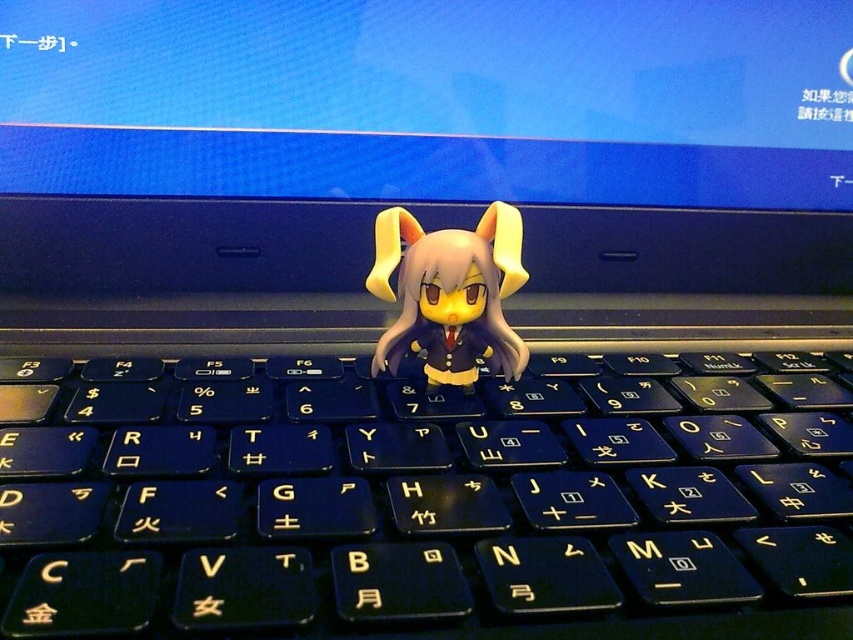
Based on the photo, you are setting up a desk for a friend who is left handed. You have a black plastic keyboard at center and a matte yellow plastic toy at center. Which object should you move to the right side of the desk to make space for their left hand?

The black plastic keyboard at center is in front of the matte yellow plastic toy at center. To make space for the left hand, move the matte yellow plastic toy at center to the right side of the desk since it is behind the keyboard and can be shifted without obstructing the primary input device.

You are trying to place a new sticker on your laptop keyboard. You have the matte yellow plastic toy at center and the black plastic keyboard at center in view. Which object is located above the other?

The matte yellow plastic toy at center is above the black plastic keyboard at center because it is positioned over it.